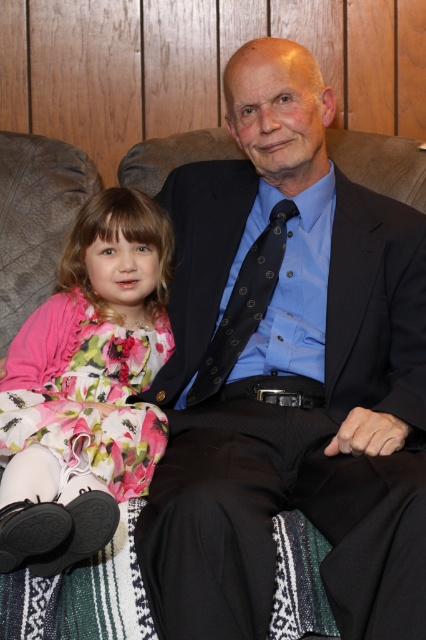
Is matte black suit at center behind black textured tie at center?

That is False.

Can you confirm if matte black suit at center is smaller than black textured tie at center?

No, matte black suit at center is not smaller than black textured tie at center.

Locate an element on the screen. matte black suit at center is located at coordinates (287, 372).

Can you confirm if floral fabric dress at left is shorter than black textured tie at center?

In fact, floral fabric dress at left may be taller than black textured tie at center.

Which is behind, point (71, 403) or point (232, 346)?

Positioned behind is point (232, 346).

Image resolution: width=426 pixels, height=640 pixels. Find the location of `floral fabric dress at left`. floral fabric dress at left is located at coordinates (86, 387).

Is point (298, 308) positioned after point (66, 372)?

Yes, point (298, 308) is behind point (66, 372).

From the picture: Is matte black suit at center positioned before floral fabric dress at left?

Yes, matte black suit at center is in front of floral fabric dress at left.

Between point (402, 266) and point (137, 449), which one is positioned behind?

The point (402, 266) is behind.

The height and width of the screenshot is (640, 426). I want to click on matte black suit at center, so click(x=287, y=372).